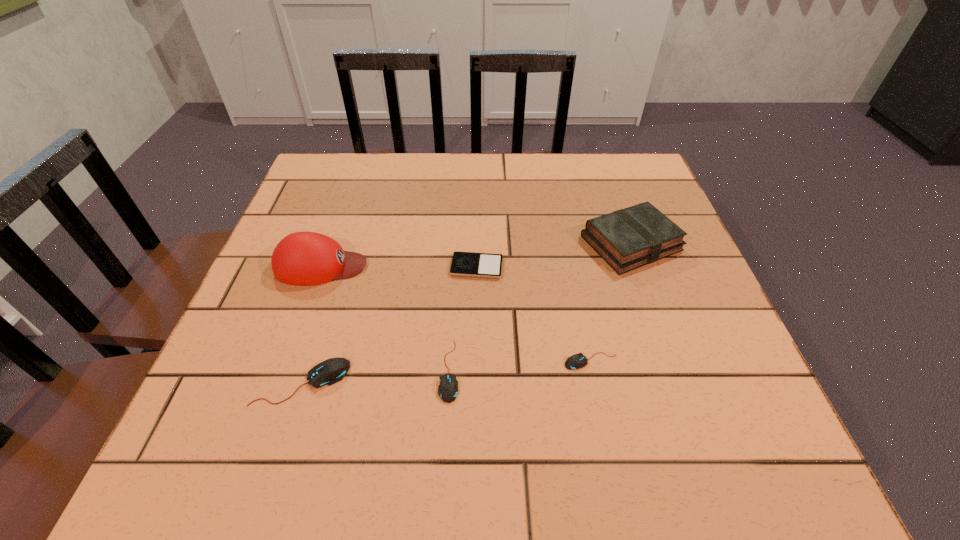
The image size is (960, 540). I want to click on mouse that is the third closest to the iPod, so click(x=333, y=370).

This screenshot has width=960, height=540. I want to click on vacant space that satisfies the following two spatial constraints: 1. on the front-facing side of the tallest object; 2. on the right side of the fourth shortest object, so click(279, 382).

Find the location of a particular element. vacant space that satisfies the following two spatial constraints: 1. on the back side of the shortest mouse; 2. on the front-facing side of the tallest object is located at coordinates (571, 266).

At what (x,y) coordinates should I click in order to perform the action: click on free space in the image that satisfies the following two spatial constraints: 1. on the front-facing side of the baseball cap; 2. on the right side of the third tallest object. Please return your answer as a coordinate pair (x, y). This screenshot has height=540, width=960. Looking at the image, I should click on (279, 382).

Image resolution: width=960 pixels, height=540 pixels. What are the coordinates of `vacant area that satisfies the following two spatial constraints: 1. on the back side of the leftmost mouse; 2. on the right side of the shortest mouse` in the screenshot? It's located at (308, 361).

What are the coordinates of `free space in the image that satisfies the following two spatial constraints: 1. on the back side of the tallest mouse; 2. on the left side of the iPod` in the screenshot? It's located at (339, 267).

At what (x,y) coordinates should I click in order to perform the action: click on free spot that satisfies the following two spatial constraints: 1. on the front-facing side of the baseball cap; 2. on the back side of the rightmost mouse. Please return your answer as a coordinate pair (x, y). Image resolution: width=960 pixels, height=540 pixels. Looking at the image, I should click on (287, 361).

Where is `vacant area in the image that satisfies the following two spatial constraints: 1. on the front-facing side of the shortest object; 2. on the right side of the baseball cap`? The width and height of the screenshot is (960, 540). vacant area in the image that satisfies the following two spatial constraints: 1. on the front-facing side of the shortest object; 2. on the right side of the baseball cap is located at coordinates (321, 267).